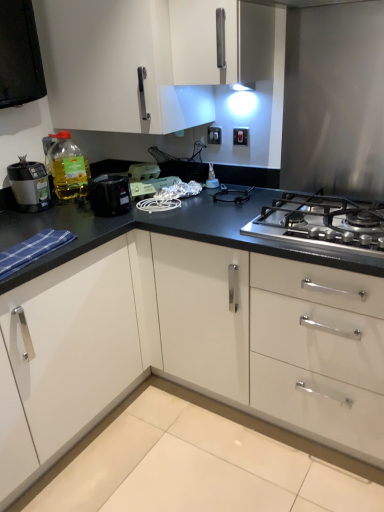
Question: From a real-world perspective, is white plastic electric outlet at upper center, positioned as the 2th electric outlet in back-to-front order, beneath matte black blender at left, acting as the second kitchen appliance starting from the right?

Choices:
 (A) yes
 (B) no

Answer: (B)

Question: Is matte black blender at left, acting as the second kitchen appliance starting from the right, a part of white plastic electric outlet at upper center, positioned as the 2th electric outlet in back-to-front order?

Choices:
 (A) no
 (B) yes

Answer: (A)

Question: Is white plastic electric outlet at upper center, the first electric outlet positioned from the right, taller than matte black blender at left, acting as the second kitchen appliance starting from the right?

Choices:
 (A) yes
 (B) no

Answer: (B)

Question: From a real-world perspective, is white plastic electric outlet at upper center, marked as the second electric outlet in a left-to-right arrangement, physically above matte black blender at left, the 1th kitchen appliance in the left-to-right sequence?

Choices:
 (A) yes
 (B) no

Answer: (A)

Question: From the image's perspective, is white plastic electric outlet at upper center, which is the first electric outlet from front to back, located beneath matte black blender at left, acting as the second kitchen appliance starting from the right?

Choices:
 (A) no
 (B) yes

Answer: (A)

Question: Is white plastic electric outlet at upper center, marked as the second electric outlet in a left-to-right arrangement, at the right side of matte black blender at left, the 1th kitchen appliance in the left-to-right sequence?

Choices:
 (A) no
 (B) yes

Answer: (B)

Question: Does translucent yellow bottle at left have a greater width compared to white plastic electric outlet at upper center, which is the first electric outlet from front to back?

Choices:
 (A) no
 (B) yes

Answer: (B)

Question: Considering the relative positions of translucent yellow bottle at left and white plastic electric outlet at upper center, positioned as the 2th electric outlet in back-to-front order, in the image provided, is translucent yellow bottle at left to the right of white plastic electric outlet at upper center, positioned as the 2th electric outlet in back-to-front order, from the viewer's perspective?

Choices:
 (A) yes
 (B) no

Answer: (B)

Question: Is translucent yellow bottle at left shorter than white plastic electric outlet at upper center, marked as the second electric outlet in a left-to-right arrangement?

Choices:
 (A) yes
 (B) no

Answer: (B)

Question: Is translucent yellow bottle at left oriented away from white plastic electric outlet at upper center, marked as the second electric outlet in a left-to-right arrangement?

Choices:
 (A) no
 (B) yes

Answer: (A)

Question: Is translucent yellow bottle at left positioned far away from white plastic electric outlet at upper center, positioned as the 2th electric outlet in back-to-front order?

Choices:
 (A) no
 (B) yes

Answer: (A)

Question: Is translucent yellow bottle at left outside of white plastic electric outlet at upper center, the first electric outlet positioned from the right?

Choices:
 (A) yes
 (B) no

Answer: (A)

Question: From the image's perspective, would you say stainless steel gas stove at center is shown under white plastic electric outlet at upper center, which is the first electric outlet from front to back?

Choices:
 (A) no
 (B) yes

Answer: (B)